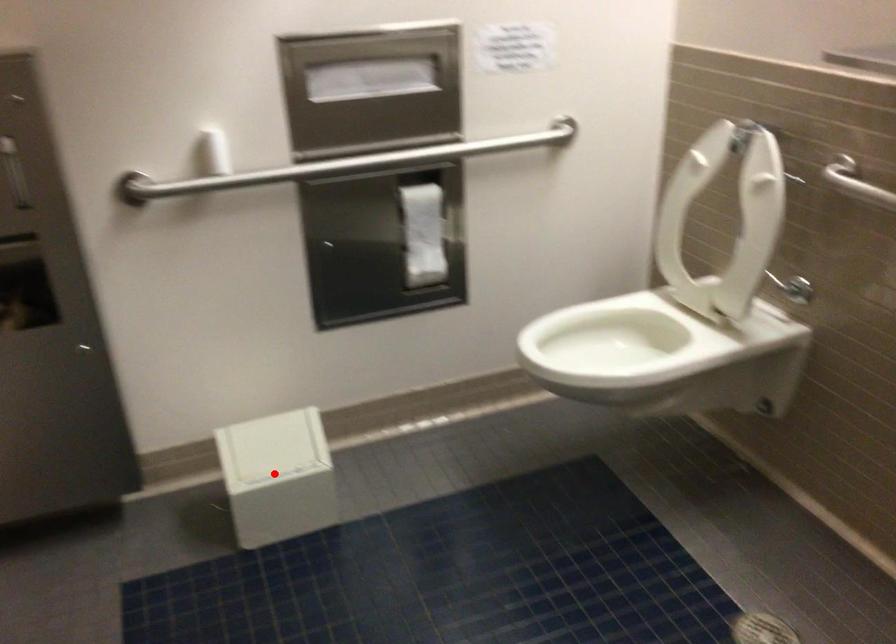
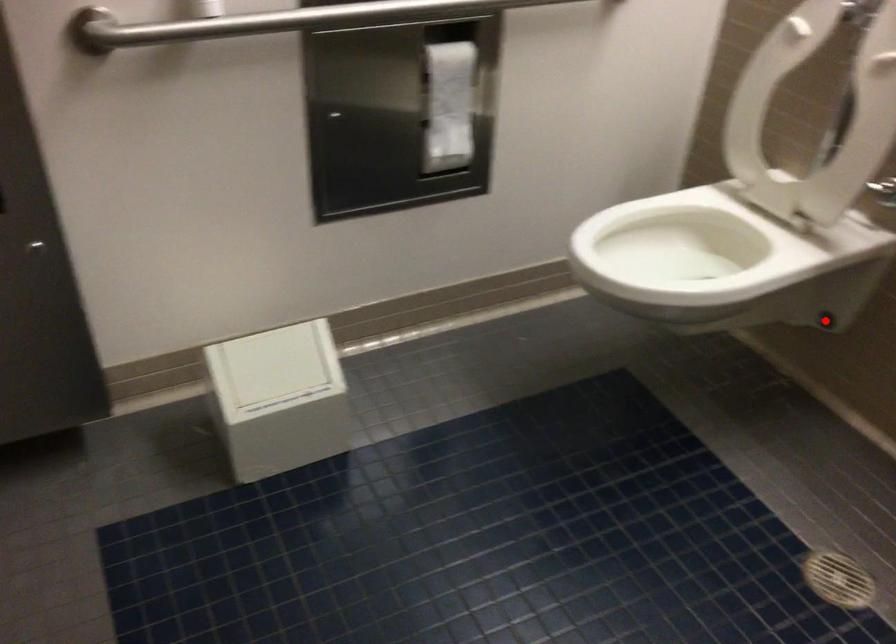
I am providing you with two images of the same scene from different viewpoints. A red point is marked on the first image and another point is marked on the second image. Does the point marked in image1 correspond to the same location as the one in image2?

No